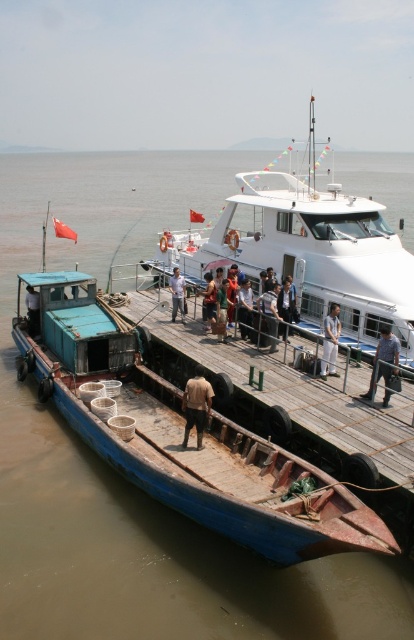
You are a photographer standing at the dock. You want to capture a photo of the white glossy boat at center and the brown fabric shirt at center. However, you notice that one of these objects might be blocking the view of the other. Based on their sizes, which object is more likely to block the view of the other?

The white glossy boat at center is taller than the brown fabric shirt at center, so the white glossy boat at center is more likely to block the view of the brown fabric shirt at center.

You are a photographer trying to capture a closeup of the light brown fabric pants at center and the light brown wooden pole at center. Since you want to focus on the details of both objects, which one should you zoom in on more to ensure they are both in focus?

The light brown fabric pants at center is wider than the light brown wooden pole at center, so you should zoom in more on the light brown wooden pole at center to ensure both are in focus.

You are a photographer trying to capture a person standing on the smaller blue boat at the dock. You notice the dark blue jeans at center and the brown leather jacket at center. Which item should you focus on to ensure the person is fully visible in your photo?

The dark blue jeans at center is located below the brown leather jacket at center. To ensure the person is fully visible, focus on the brown leather jacket at center as it is higher up and more prominent.